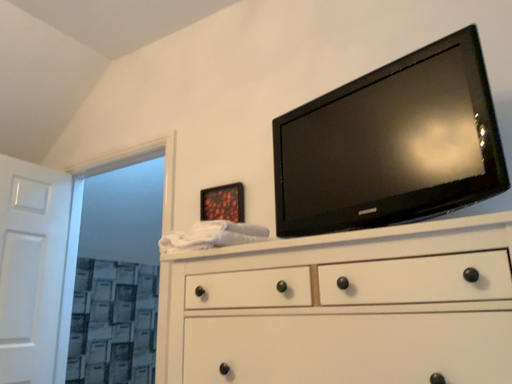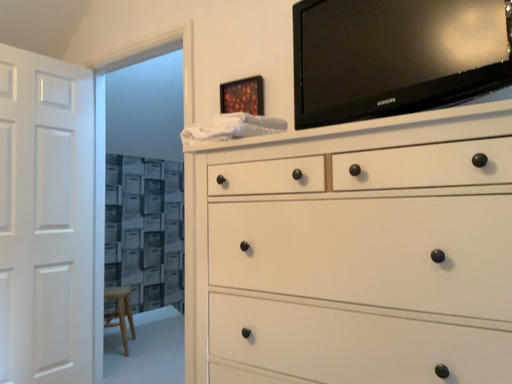
Question: How did the camera likely rotate when shooting the video?

Choices:
 (A) rotated upward
 (B) rotated downward

Answer: (B)